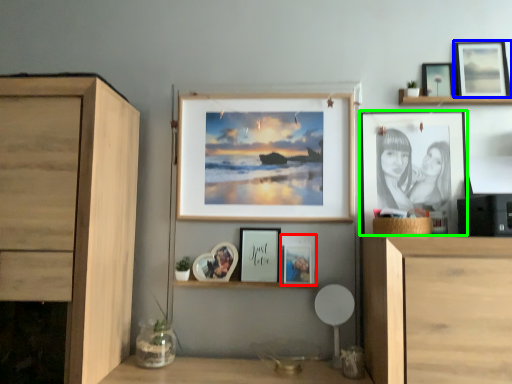
Question: Which object is the closest to the picture frame (highlighted by a red box)? Choose among these: picture frame (highlighted by a blue box) or picture frame (highlighted by a green box).

Choices:
 (A) picture frame
 (B) picture frame

Answer: (B)